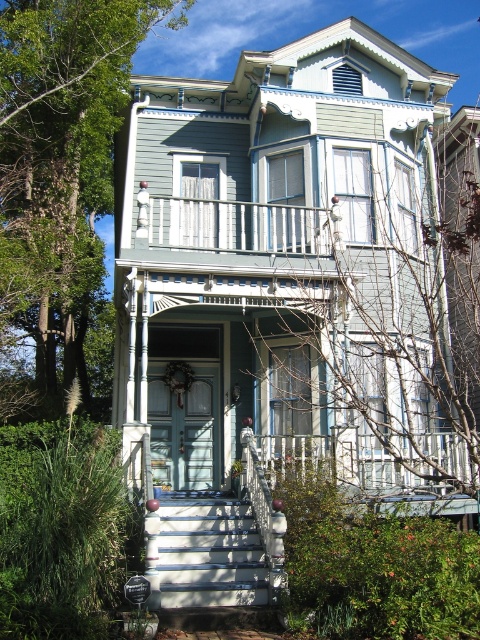
Question: Among these points, which one is farthest from the camera?

Choices:
 (A) (179, 218)
 (B) (216, 554)

Answer: (A)

Question: Can you confirm if white painted wood stairs at center is positioned below metallic silver balustrade at upper center?

Choices:
 (A) no
 (B) yes

Answer: (B)

Question: Which point is closer to the camera taking this photo?

Choices:
 (A) (147, 538)
 (B) (288, 225)

Answer: (A)

Question: Which point is closer to the camera?

Choices:
 (A) (237, 588)
 (B) (230, 202)

Answer: (A)

Question: Considering the relative positions of white painted wood stairs at center and metallic silver balustrade at upper center in the image provided, where is white painted wood stairs at center located with respect to metallic silver balustrade at upper center?

Choices:
 (A) below
 (B) above

Answer: (A)

Question: In this image, where is white painted wood stairs at center located relative to metallic silver balustrade at upper center?

Choices:
 (A) right
 (B) left

Answer: (B)